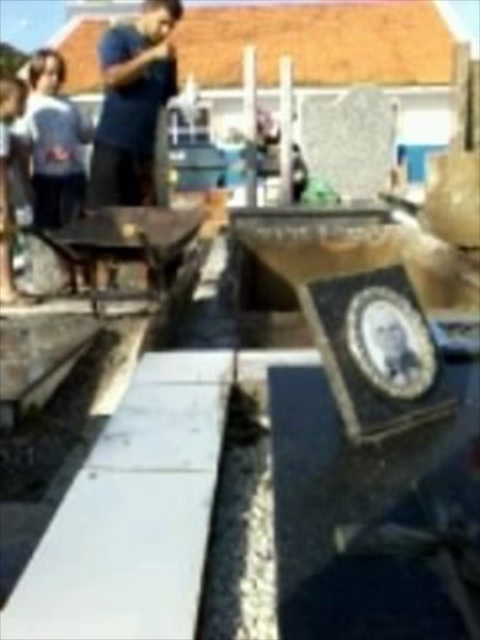
Is dark blue t-shirt at upper center wider than white cotton shirt at upper left?

Correct, the width of dark blue t-shirt at upper center exceeds that of white cotton shirt at upper left.

Who is more distant from viewer, (119, 166) or (79, 109)?

The point (79, 109) is behind.

Where is `dark blue t-shirt at upper center`? The height and width of the screenshot is (640, 480). dark blue t-shirt at upper center is located at coordinates (132, 104).

Is white cotton shirt at upper left to the left of matte black shirt at left from the viewer's perspective?

In fact, white cotton shirt at upper left is to the right of matte black shirt at left.

Locate an element on the screen. white cotton shirt at upper left is located at coordinates (52, 144).

Which is behind, point (127, 131) or point (1, 122)?

The point (127, 131) is more distant.

Image resolution: width=480 pixels, height=640 pixels. What do you see at coordinates (132, 104) in the screenshot?
I see `dark blue t-shirt at upper center` at bounding box center [132, 104].

I want to click on dark blue t-shirt at upper center, so click(x=132, y=104).